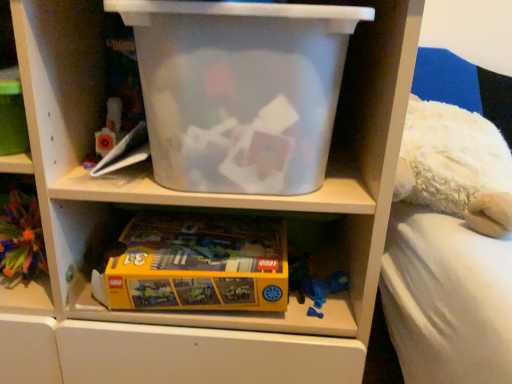
Question: Is the position of transparent plastic storage box at upper center more distant than that of yellow matte lego box at lower left?

Choices:
 (A) no
 (B) yes

Answer: (A)

Question: Are transparent plastic storage box at upper center and yellow matte lego box at lower left making contact?

Choices:
 (A) no
 (B) yes

Answer: (A)

Question: Is transparent plastic storage box at upper center at the left side of yellow matte lego box at lower left?

Choices:
 (A) no
 (B) yes

Answer: (A)

Question: Considering the relative sizes of transparent plastic storage box at upper center and yellow matte lego box at lower left in the image provided, is transparent plastic storage box at upper center bigger than yellow matte lego box at lower left?

Choices:
 (A) yes
 (B) no

Answer: (A)

Question: Considering the relative sizes of transparent plastic storage box at upper center and yellow matte lego box at lower left in the image provided, is transparent plastic storage box at upper center shorter than yellow matte lego box at lower left?

Choices:
 (A) no
 (B) yes

Answer: (A)

Question: Does transparent plastic storage box at upper center appear on the right side of yellow matte lego box at lower left?

Choices:
 (A) yes
 (B) no

Answer: (A)

Question: Considering the relative sizes of yellow cardboard lego box at lower center and transparent plastic storage box at upper center in the image provided, is yellow cardboard lego box at lower center smaller than transparent plastic storage box at upper center?

Choices:
 (A) yes
 (B) no

Answer: (A)

Question: Is yellow cardboard lego box at lower center closer to the viewer compared to transparent plastic storage box at upper center?

Choices:
 (A) yes
 (B) no

Answer: (B)

Question: Considering the relative positions of yellow cardboard lego box at lower center and transparent plastic storage box at upper center in the image provided, is yellow cardboard lego box at lower center to the right of transparent plastic storage box at upper center from the viewer's perspective?

Choices:
 (A) no
 (B) yes

Answer: (A)

Question: Are yellow cardboard lego box at lower center and transparent plastic storage box at upper center far apart?

Choices:
 (A) yes
 (B) no

Answer: (B)

Question: Considering the relative sizes of yellow cardboard lego box at lower center and transparent plastic storage box at upper center in the image provided, is yellow cardboard lego box at lower center thinner than transparent plastic storage box at upper center?

Choices:
 (A) yes
 (B) no

Answer: (B)

Question: Is transparent plastic storage box at upper center surrounded by yellow cardboard lego box at lower center?

Choices:
 (A) yes
 (B) no

Answer: (B)

Question: Considering the relative positions of transparent plastic storage box at upper center and yellow cardboard lego box at lower center in the image provided, is transparent plastic storage box at upper center to the right of yellow cardboard lego box at lower center from the viewer's perspective?

Choices:
 (A) no
 (B) yes

Answer: (B)